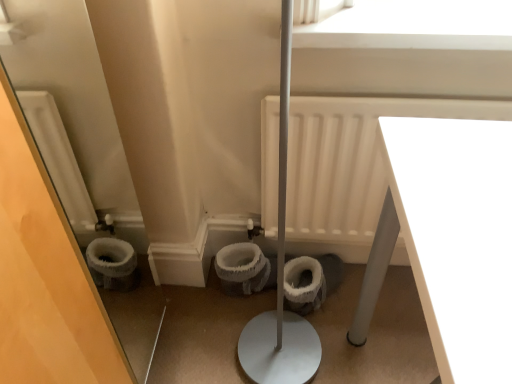
Question: Considering the positions of white glossy table at lower right and white fluffy toilet bowl at center, the 2th toilet bowl in the left-to-right sequence, in the image, is white glossy table at lower right wider or thinner than white fluffy toilet bowl at center, the 2th toilet bowl in the left-to-right sequence,?

Choices:
 (A) thin
 (B) wide

Answer: (B)

Question: From the image's perspective, is white glossy table at lower right located above or below white fluffy toilet bowl at center, which appears as the first toilet bowl when viewed from the right?

Choices:
 (A) above
 (B) below

Answer: (B)

Question: Estimate the real-world distances between objects in this image. Which object is farther from the white glossy table at lower right?

Choices:
 (A) white matte radiator at center
 (B) white fluffy toilet bowl at center, the 2th toilet bowl in the left-to-right sequence
 (C) white fuzzy toilet bowl at center, placed as the second toilet bowl when sorted from right to left
 (D) white matte window screen at upper center

Answer: (C)

Question: Which object is the farthest from the white fluffy toilet bowl at center, the 2th toilet bowl in the left-to-right sequence?

Choices:
 (A) white matte window screen at upper center
 (B) white glossy table at lower right
 (C) white fuzzy toilet bowl at center, which is the 1th toilet bowl from left to right
 (D) white matte radiator at center

Answer: (A)